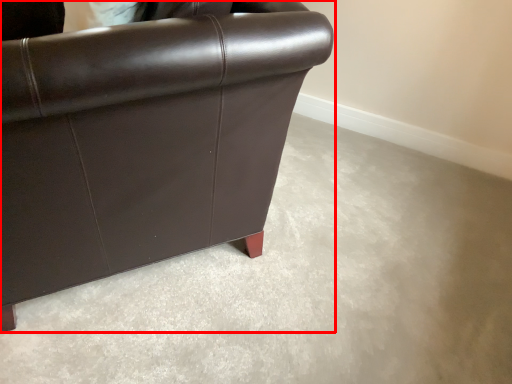
Question: From the image's perspective, where is chair (annotated by the red box) located in relation to concrete in the image?

Choices:
 (A) below
 (B) above

Answer: (B)